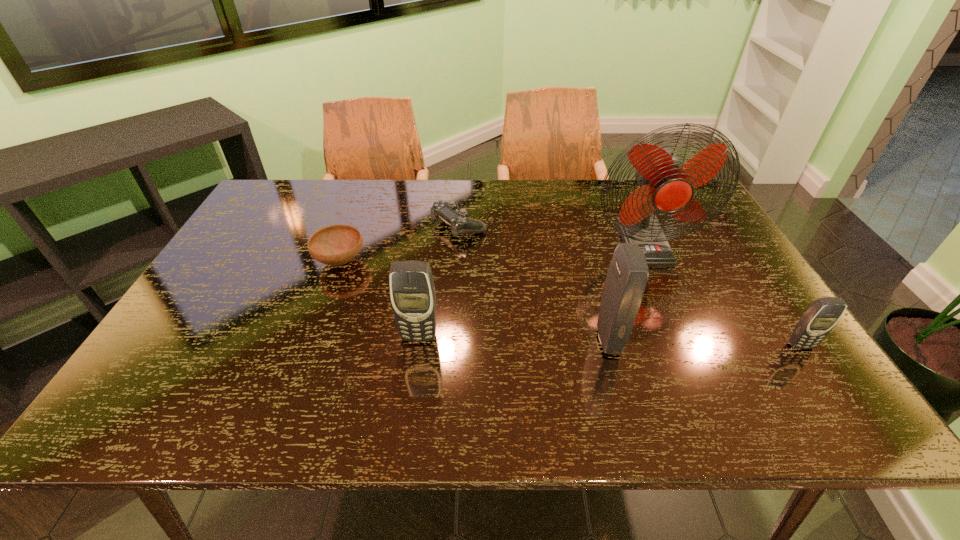
Where is `free space located on the front face of the rightmost cellular telephone`? The width and height of the screenshot is (960, 540). free space located on the front face of the rightmost cellular telephone is located at coordinates (824, 380).

This screenshot has width=960, height=540. I want to click on free space located on the front of the control, so click(x=451, y=347).

Find the location of a particular element. The height and width of the screenshot is (540, 960). free space located on the front-facing side of the tallest object is located at coordinates (670, 304).

The height and width of the screenshot is (540, 960). Find the location of `vacant point located 0.260m on the left of the bowl`. vacant point located 0.260m on the left of the bowl is located at coordinates (222, 261).

The height and width of the screenshot is (540, 960). Identify the location of object at the far edge. (449, 211).

Locate an element on the screen. This screenshot has height=540, width=960. cellular telephone that is at the right edge is located at coordinates (819, 319).

The height and width of the screenshot is (540, 960). Find the location of `fan situated at the right edge`. fan situated at the right edge is located at coordinates (666, 186).

Locate an element on the screen. The image size is (960, 540). object that is at the near right corner is located at coordinates (819, 319).

In the image, there is a desktop. In order to click on vacant space at the far edge in this screenshot , I will do `click(537, 180)`.

In the image, there is a desktop. In order to click on vacant area at the near edge in this screenshot , I will do `click(613, 360)`.